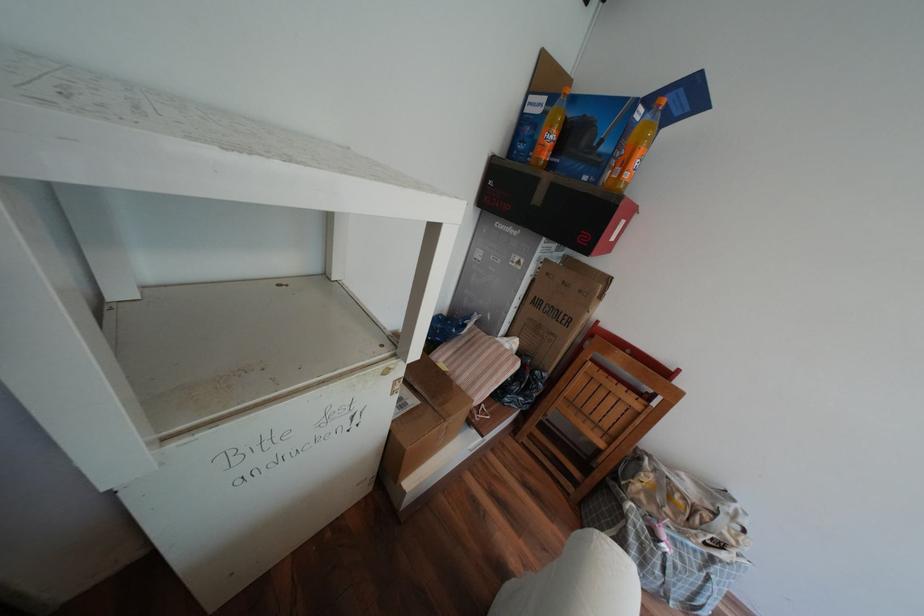
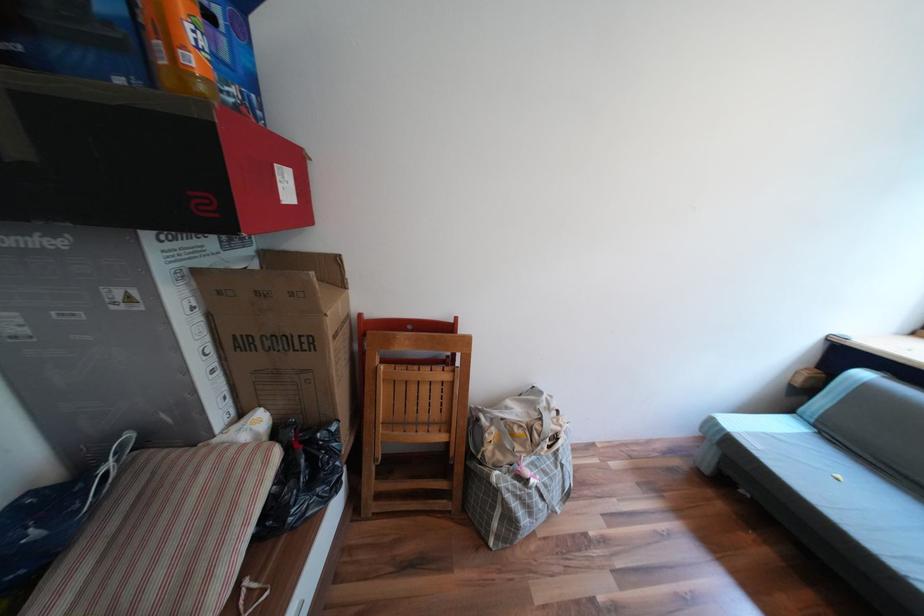
In the second image, find the point that corresponds to pixel 651 474 in the first image.

(495, 435)